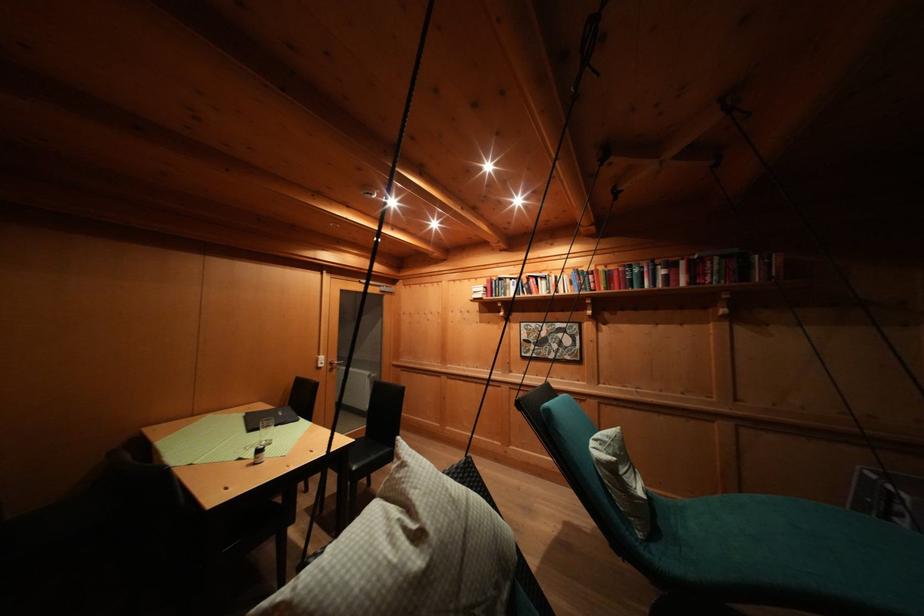
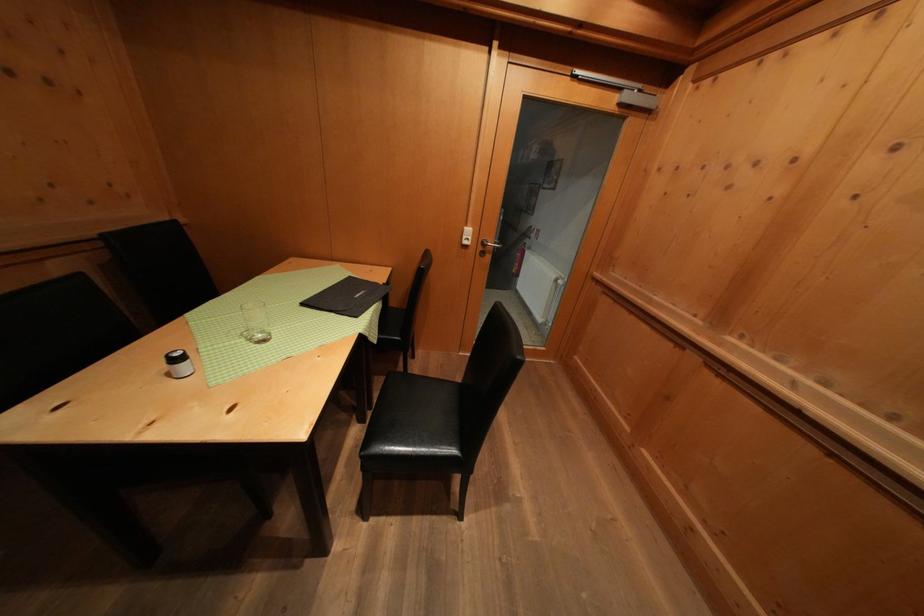
Locate, in the second image, the point that corresponds to point (337, 369) in the first image.

(490, 249)